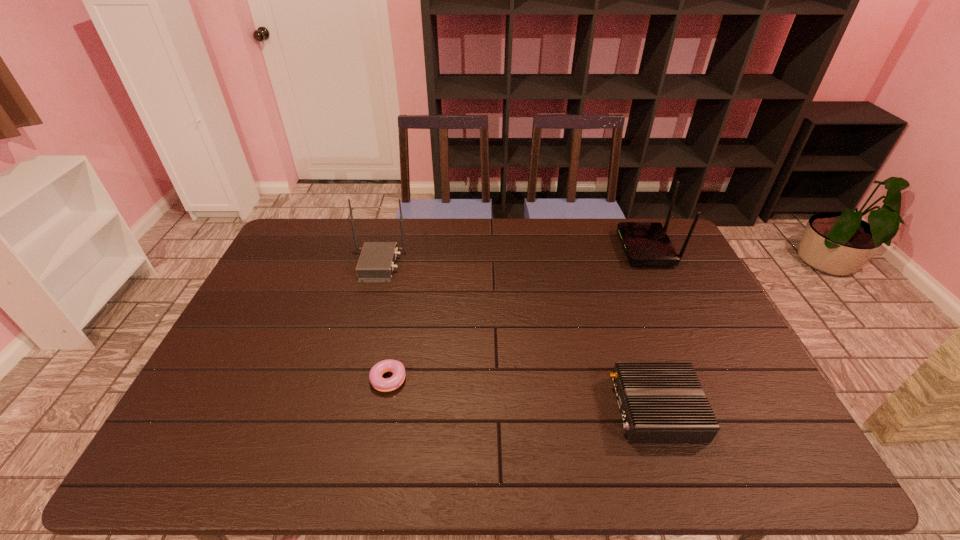
The width and height of the screenshot is (960, 540). I want to click on object at the right edge, so click(x=645, y=243).

In order to click on object situated at the far right corner in this screenshot , I will do (645, 243).

In the image, there is a desktop. Where is `free space at the far edge`? The image size is (960, 540). free space at the far edge is located at coordinates (583, 251).

Locate an element on the screen. free space at the left edge is located at coordinates (244, 359).

Locate an element on the screen. vacant space at the right edge of the desktop is located at coordinates (735, 357).

Locate an element on the screen. free area in between the doughnut and the second shortest object is located at coordinates pyautogui.click(x=522, y=396).

What are the coordinates of `vacant space that's between the third tallest object and the leftmost router` in the screenshot? It's located at (517, 337).

Identify the location of free space between the leftmost router and the doughnut. coord(383,324).

In order to click on vacant region between the doughnut and the leftmost router in this screenshot , I will do `click(383, 324)`.

I want to click on empty space between the shortest object and the leftmost router, so click(383, 324).